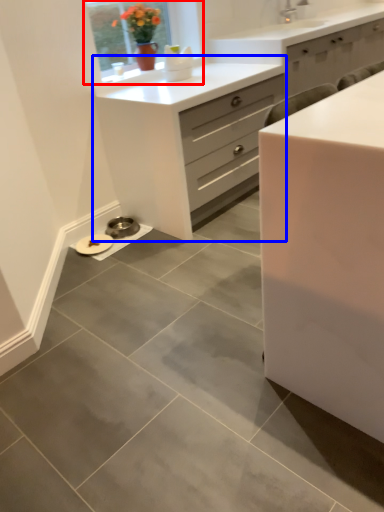
Question: Which of the following is the closest to the observer, window (highlighted by a red box) or chest of drawers (highlighted by a blue box)?

Choices:
 (A) window
 (B) chest of drawers

Answer: (B)